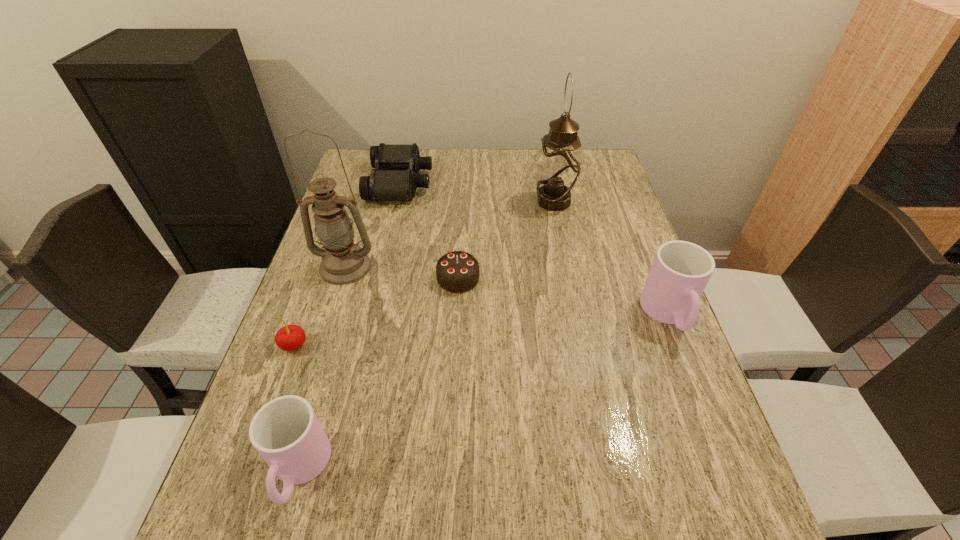
The image size is (960, 540). I want to click on cherry at the left edge, so tap(291, 337).

Locate an element on the screen. oil lamp that is at the left edge is located at coordinates (343, 262).

Where is `cup that is at the right edge`? Image resolution: width=960 pixels, height=540 pixels. cup that is at the right edge is located at coordinates (680, 271).

What are the coordinates of `oil lamp that is at the right edge` in the screenshot? It's located at point(559,168).

In order to click on object that is positioned at the far left corner in this screenshot , I will do `click(394, 178)`.

At what (x,y) coordinates should I click in order to perform the action: click on object that is at the near left corner. Please return your answer as a coordinate pair (x, y). The height and width of the screenshot is (540, 960). Looking at the image, I should click on [x=286, y=432].

Where is `free region at the far edge of the desktop`? This screenshot has height=540, width=960. free region at the far edge of the desktop is located at coordinates (522, 161).

Locate an element on the screen. vacant space at the left edge of the desktop is located at coordinates (336, 345).

You are a GUI agent. You are given a task and a screenshot of the screen. Output one action in this format:
    pyautogui.click(x=<x>, y=<y>)
    Task: Click on the vacant space at the right edge of the desktop
    
    Given the screenshot: What is the action you would take?
    pyautogui.click(x=628, y=245)

You are a GUI agent. You are given a task and a screenshot of the screen. Output one action in this format:
    pyautogui.click(x=<x>, y=<y>)
    Task: Click on the free space at the far left corner of the desktop
    This screenshot has height=540, width=960.
    Given the screenshot: What is the action you would take?
    pyautogui.click(x=363, y=155)